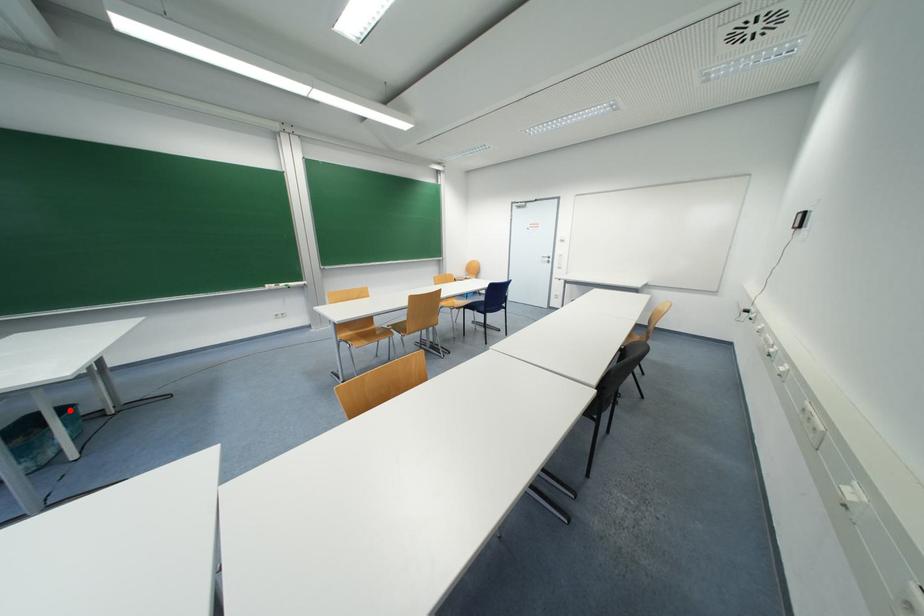
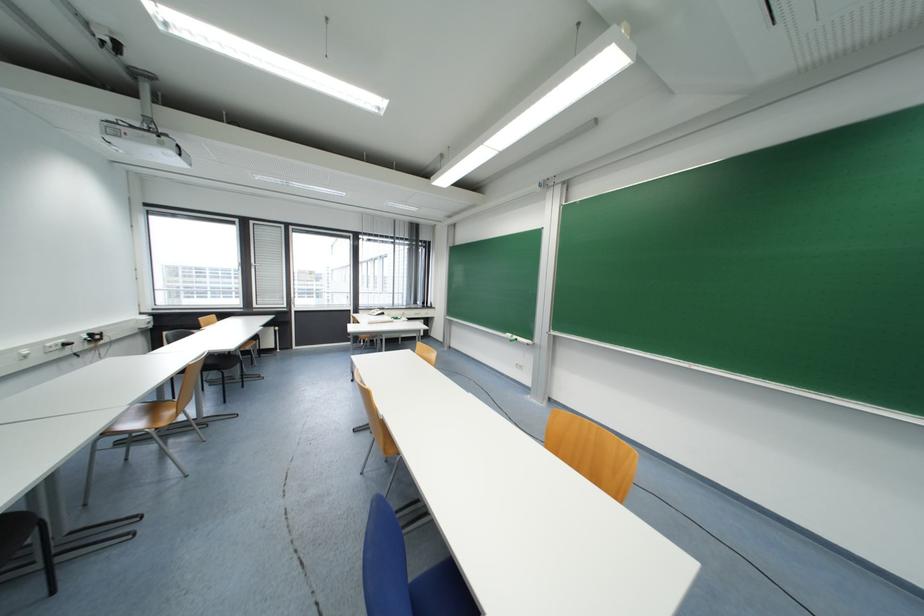
Question: I am providing you with two images of the same scene from different viewpoints. A red point is marked on the first image. At the location where the point appears in image 1, is it still visible in image 2?

Choices:
 (A) Yes
 (B) No

Answer: (B)